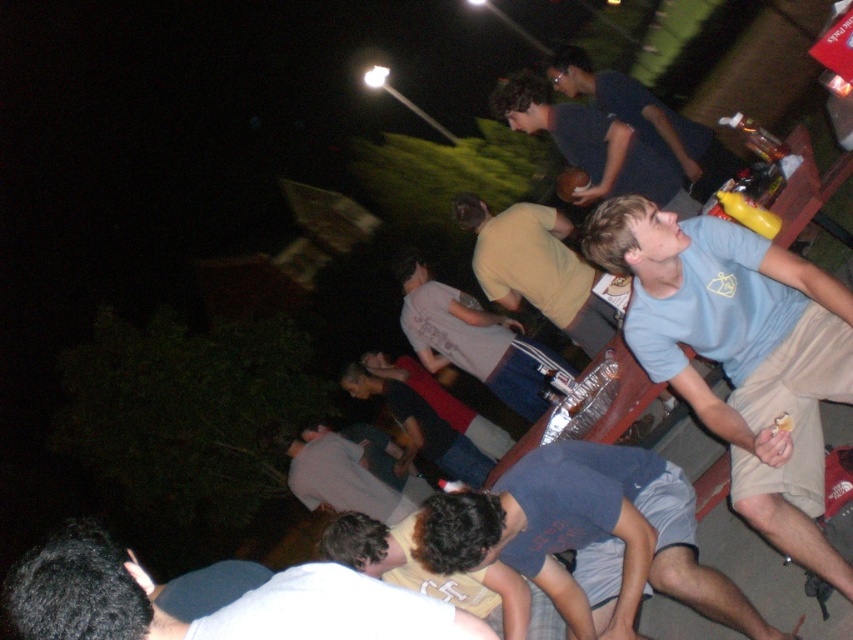
Question: Is light gray fabric shirt at lower center to the left of dark blue jeans at center from the viewer's perspective?

Choices:
 (A) no
 (B) yes

Answer: (B)

Question: Which of the following is the farthest from the observer?

Choices:
 (A) (784, 438)
 (B) (589, 179)
 (C) (540, 253)
 (D) (276, 433)

Answer: (D)

Question: Which point is closer to the camera?

Choices:
 (A) (210, 627)
 (B) (466, 371)

Answer: (A)

Question: Does light blue t-shirt at upper right appear over dark blue jeans at center?

Choices:
 (A) no
 (B) yes

Answer: (B)

Question: Which of the following is the closest to the observer?

Choices:
 (A) (598, 628)
 (B) (741, 241)

Answer: (B)

Question: Can you confirm if dark blue shorts at lower center is bigger than light gray fabric shirt at lower center?

Choices:
 (A) yes
 (B) no

Answer: (B)